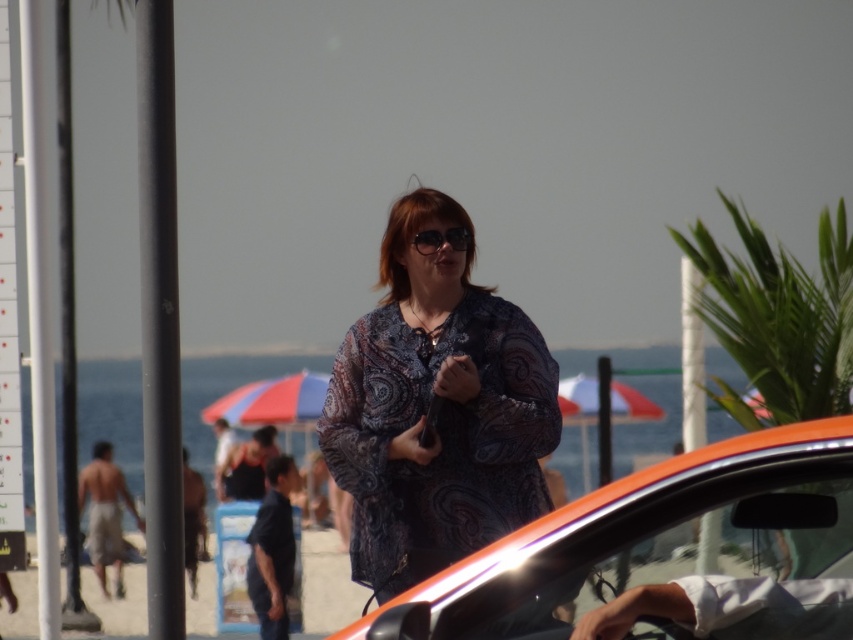
Question: Is patterned fabric blouse at center to the left of green leafy palm tree at upper right from the viewer's perspective?

Choices:
 (A) yes
 (B) no

Answer: (A)

Question: Which of the following is the closest to the observer?

Choices:
 (A) (83, 499)
 (B) (566, 612)
 (C) (392, 243)

Answer: (B)

Question: Which object is farther from the camera taking this photo?

Choices:
 (A) green leafy palm tree at upper right
 (B) matte black sunglasses at center
 (C) beige cotton shorts at lower left
 (D) orange glossy car at center

Answer: (C)

Question: Based on their relative distances, which object is nearer to the matte black sunglasses at center?

Choices:
 (A) green leafy palm tree at upper right
 (B) orange glossy car at center

Answer: (A)

Question: Is patterned fabric blouse at center closer to the viewer compared to beige cotton shorts at lower left?

Choices:
 (A) no
 (B) yes

Answer: (B)

Question: Where is patterned fabric blouse at center located in relation to green leafy palm tree at upper right in the image?

Choices:
 (A) above
 (B) below

Answer: (B)